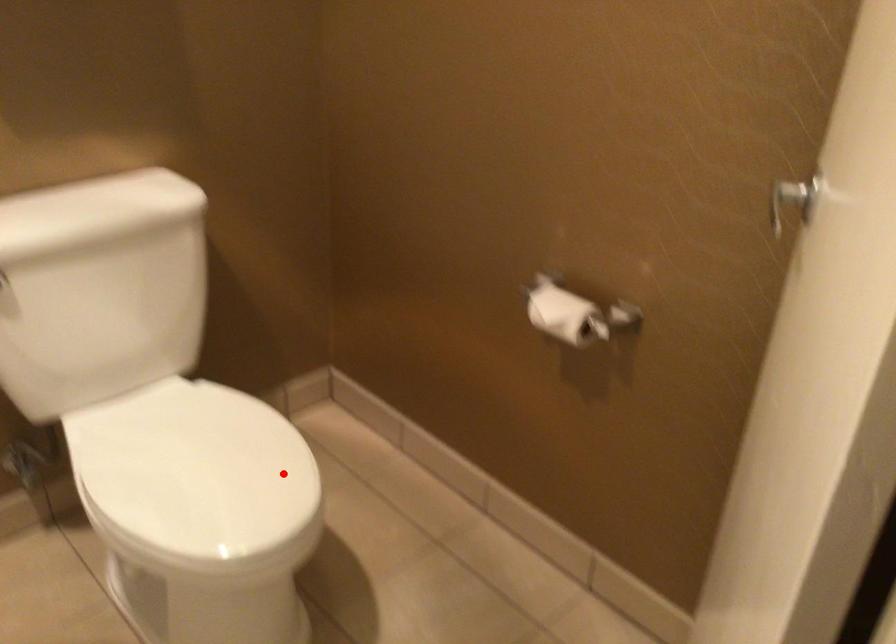
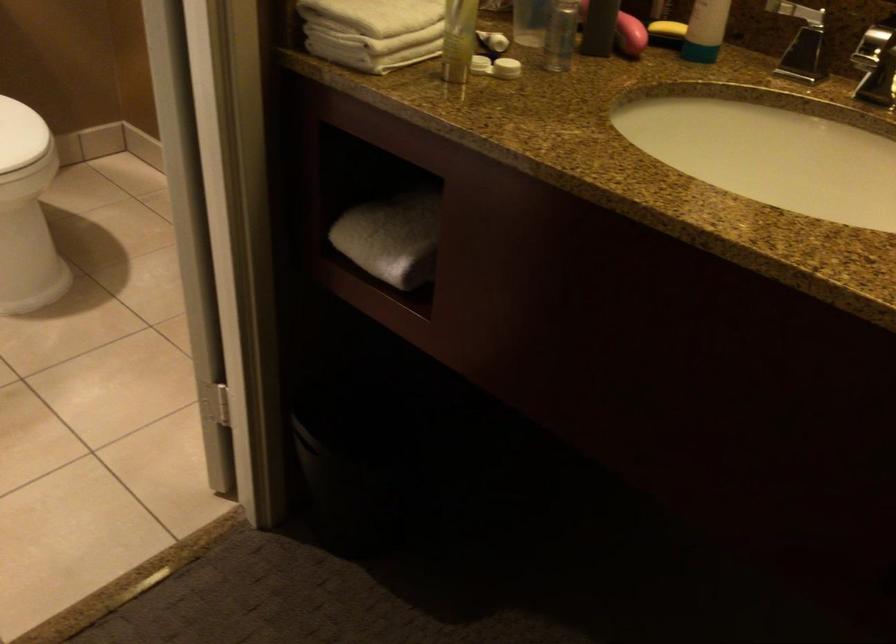
Question: A red point is marked in image1. In image2, is the corresponding 3D point closer to the camera or farther? Reply with the corresponding letter.

Choices:
 (A) The corresponding 3D point is closer.
 (B) The corresponding 3D point is farther.

Answer: (B)